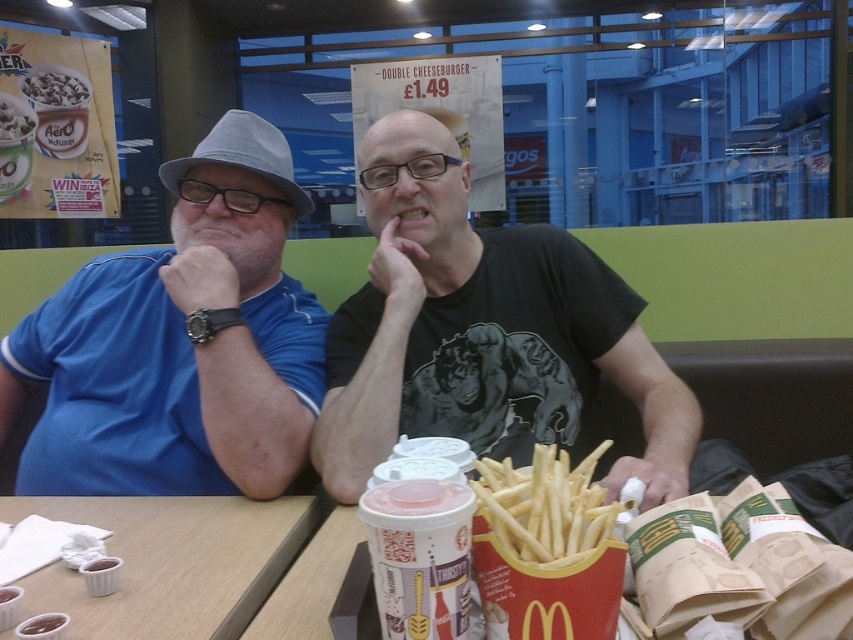
You are standing in front of the McDonalds table and want to place your phone on the table. The phone is 6 inches long. Is there enough space between the point at coordinates point (120, 577) and you to place it?

The distance between point (120, 577) and the viewer is 34.47 inches, so yes, there is enough space to place a 6 inch phone.

You are sitting at the McDonalds table and want to reach for an item. There are two points marked on the table. Which point is closer to you, point [152,596] or point [0,116]?

Point [152,596] is closer to the viewer than point [0,116], so you should reach for that one first.

You are at a McDonalds table and need to place a 10 cm wide bottle on the table. You have two options, the white paper cups at lower left and the white frosted cup at center. Which cup has a wider base to accommodate the bottle?

The white paper cups at lower left has a wider base than the white frosted cup at center, so the bottle can be placed there.